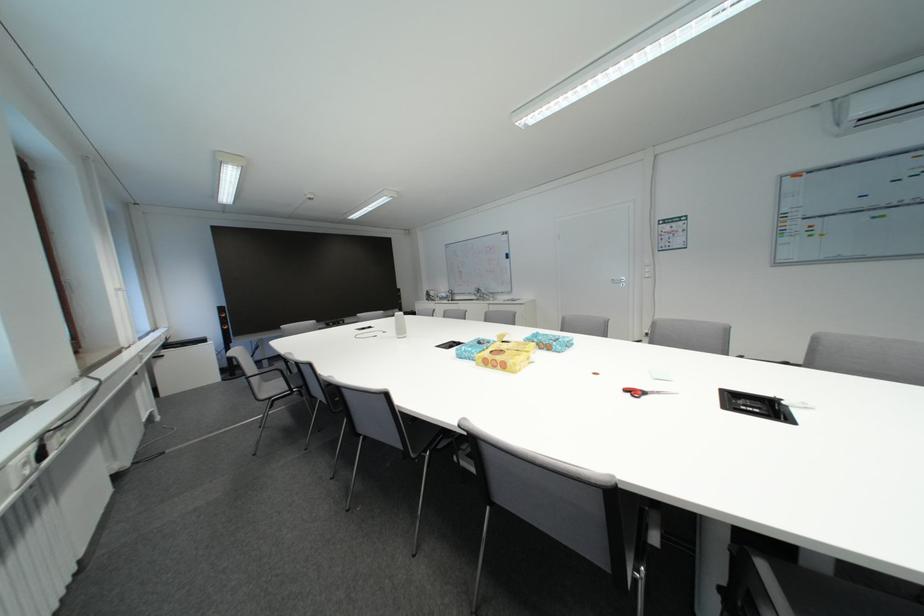
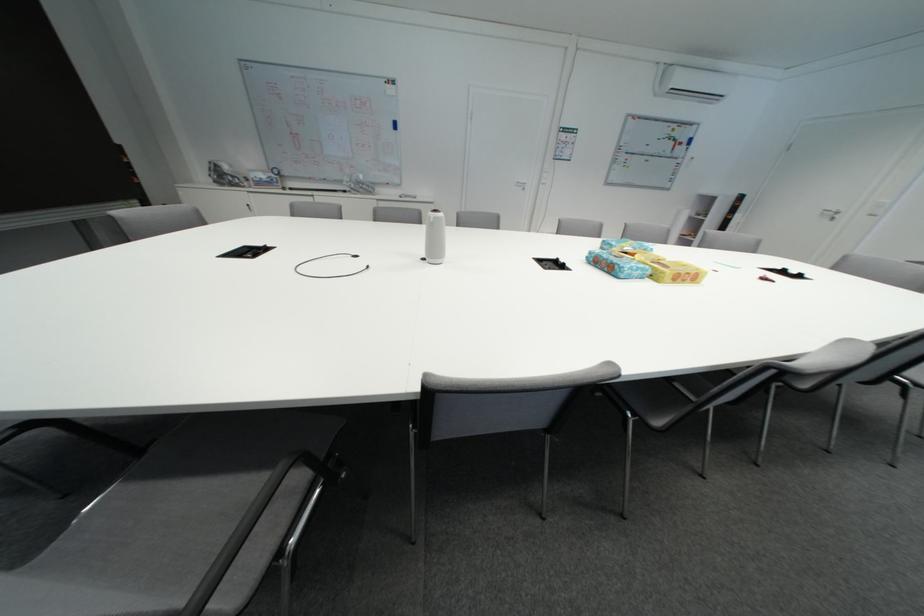
The point at (476, 354) is marked in the first image. Where is the corresponding point in the second image?

(648, 272)